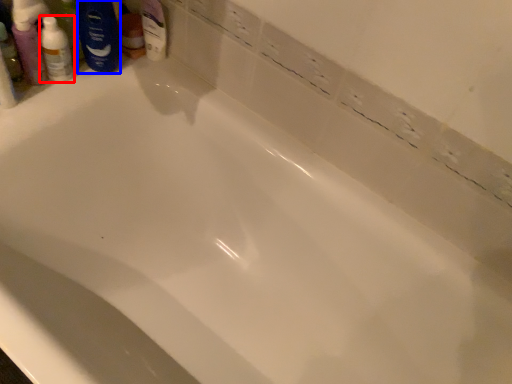
Question: Which of the following is the closest to the observer, toiletry (highlighted by a red box) or shaving cream (highlighted by a blue box)?

Choices:
 (A) toiletry
 (B) shaving cream

Answer: (A)